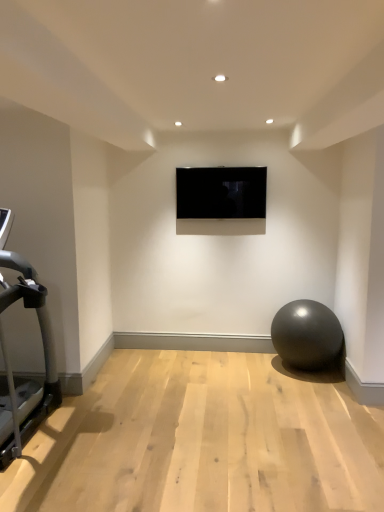
Locate an element on the screen. The width and height of the screenshot is (384, 512). blank space above black glossy tv at center (from a real-world perspective) is located at coordinates (229, 163).